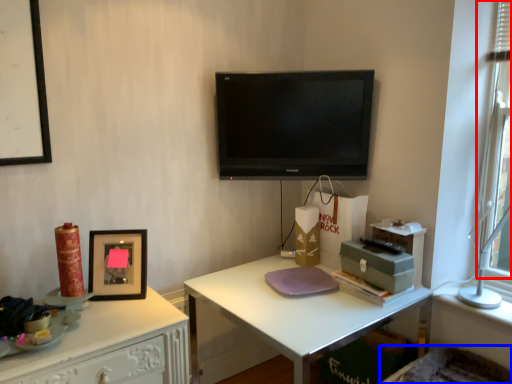
Question: Among these objects, which one is farthest to the camera, window screen (highlighted by a red box) or swivel chair (highlighted by a blue box)?

Choices:
 (A) window screen
 (B) swivel chair

Answer: (A)